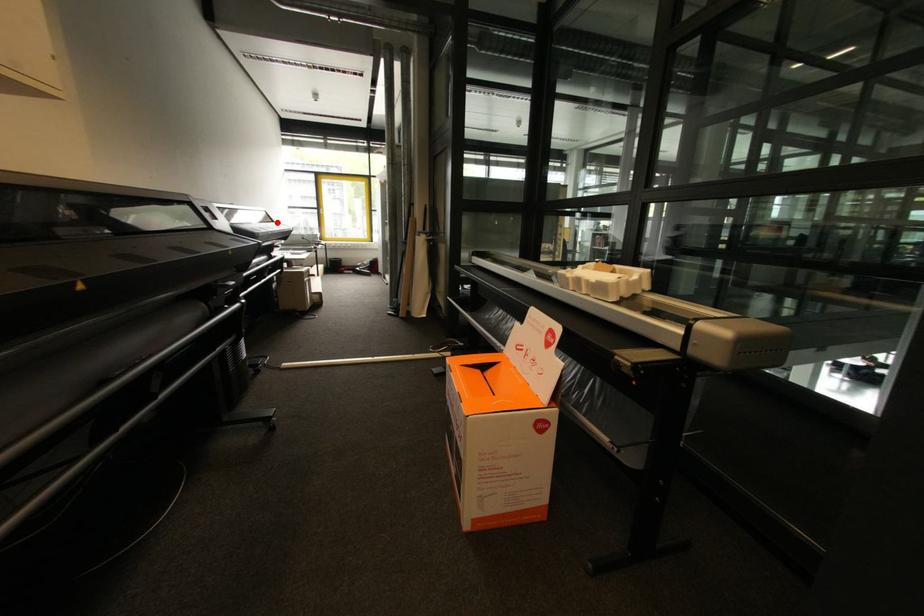
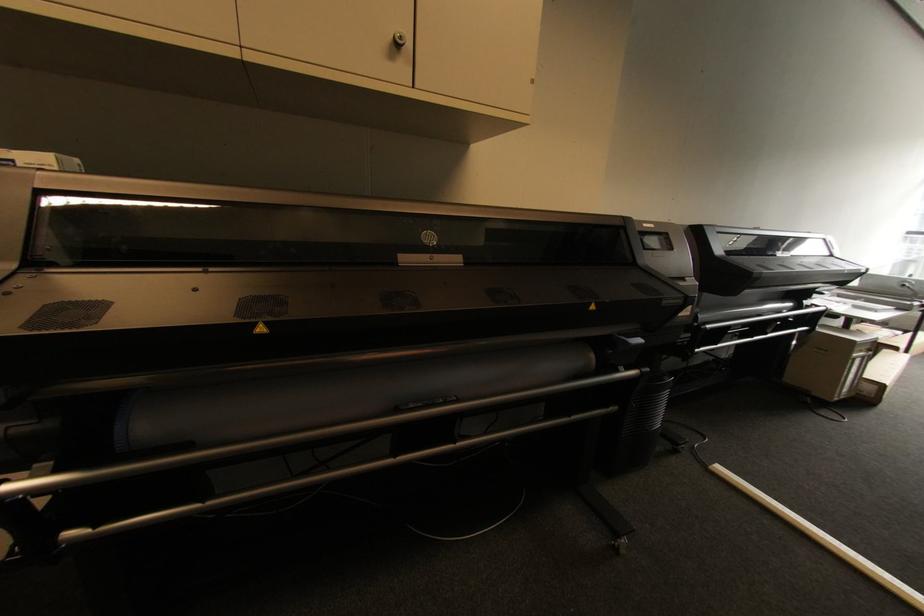
The point at the highlighted location is marked in the first image. Where is the corresponding point in the second image?

(834, 256)